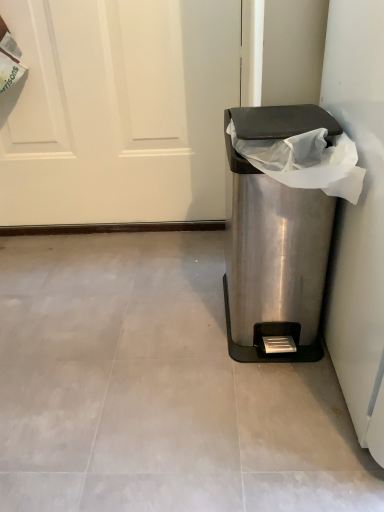
Question: Should I look upward or downward to see satin silver trash can at right?

Choices:
 (A) up
 (B) down

Answer: (A)